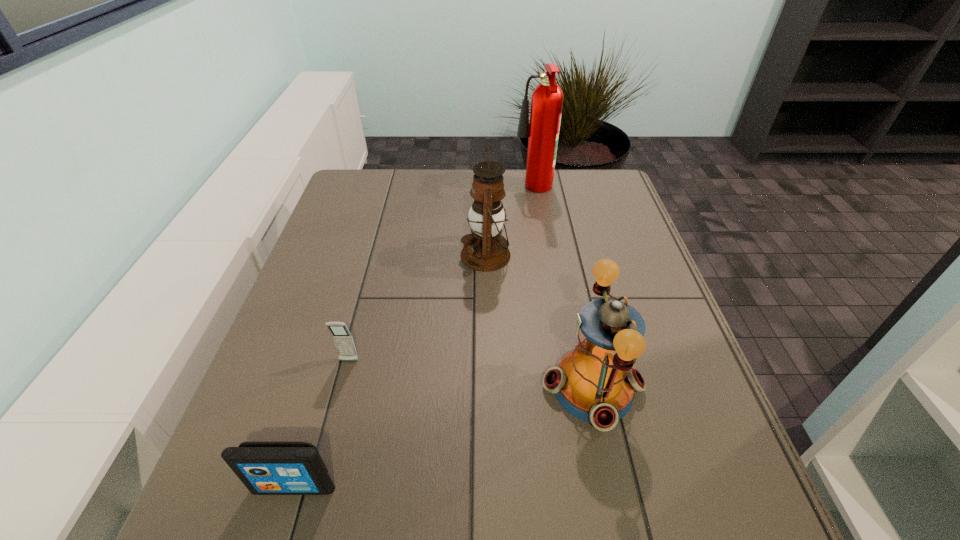
Image resolution: width=960 pixels, height=540 pixels. In the image, there is a desktop. Identify the location of vacant space at the near left corner. (194, 537).

In the image, there is a desktop. Where is `free space at the far right corner`? free space at the far right corner is located at coordinates (569, 171).

In order to click on vacant region between the shorter lantern and the cellular telephone in this screenshot , I will do 470,374.

The image size is (960, 540). Identify the location of free spot between the fire extinguisher and the nearest object. (414, 339).

I want to click on free area in between the right lantern and the fire extinguisher, so click(564, 289).

In order to click on vacant area between the third tallest object and the cellular telephone in this screenshot , I will do `click(470, 374)`.

At what (x,y) coordinates should I click in order to perform the action: click on vacant space that's between the nearest object and the fire extinguisher. Please return your answer as a coordinate pair (x, y). Image resolution: width=960 pixels, height=540 pixels. Looking at the image, I should click on (414, 339).

Locate an element on the screen. Image resolution: width=960 pixels, height=540 pixels. free space between the second tallest object and the cellular telephone is located at coordinates (418, 308).

Image resolution: width=960 pixels, height=540 pixels. Identify the location of vacant area that lies between the fourth nearest object and the cellular telephone. (418, 308).

Where is `free space between the left lantern and the cellular telephone`? The width and height of the screenshot is (960, 540). free space between the left lantern and the cellular telephone is located at coordinates (418, 308).